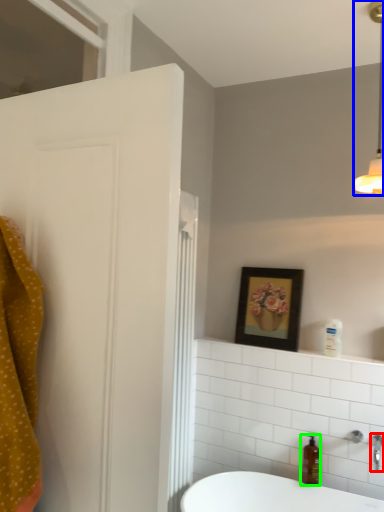
Question: Considering the real-world distances, which object is farthest from tap (highlighted by a red box)? light fixture (highlighted by a blue box) or soap dispenser (highlighted by a green box)?

Choices:
 (A) light fixture
 (B) soap dispenser

Answer: (A)